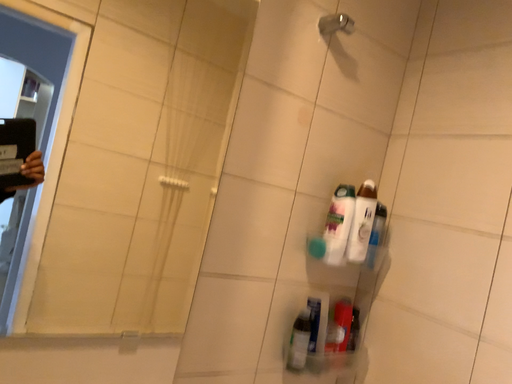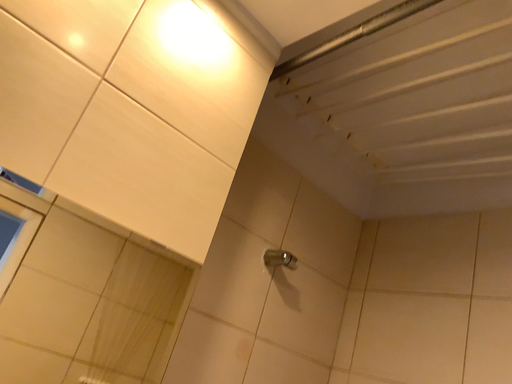
Question: How did the camera likely rotate when shooting the video?

Choices:
 (A) rotated downward
 (B) rotated upward

Answer: (B)